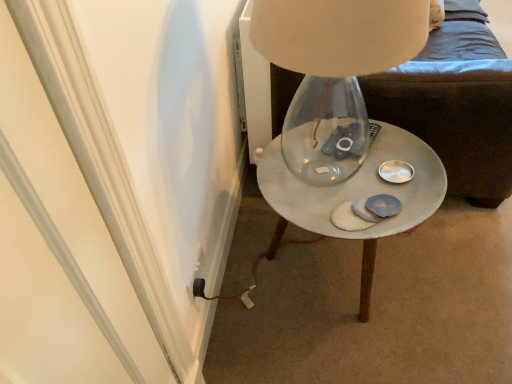
Question: From a real-world perspective, is white marble side table at center positioned above or below black plastic outlet at lower left?

Choices:
 (A) below
 (B) above

Answer: (B)

Question: Is white marble side table at center bigger or smaller than black plastic outlet at lower left?

Choices:
 (A) big
 (B) small

Answer: (A)

Question: Which of these objects is positioned closest to the white marble side table at center?

Choices:
 (A) white marble side table at center
 (B) black plastic outlet at lower left

Answer: (A)

Question: Estimate the real-world distances between objects in this image. Which object is closer to the black plastic outlet at lower left?

Choices:
 (A) white marble side table at center
 (B) white marble side table at center

Answer: (A)